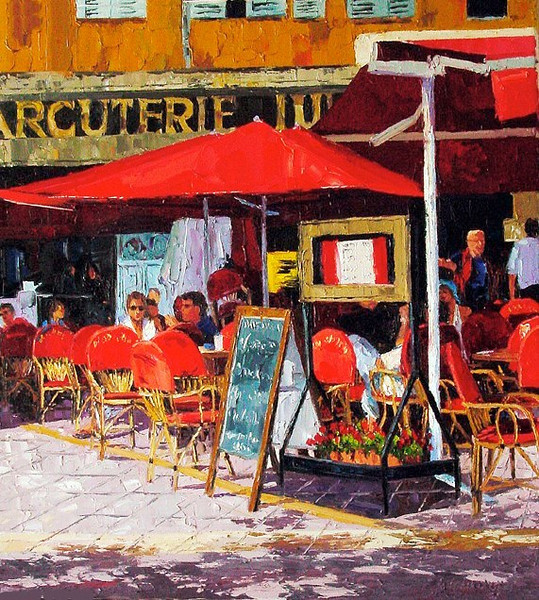
The image size is (539, 600). In order to click on table in this screenshot , I will do `click(499, 356)`.